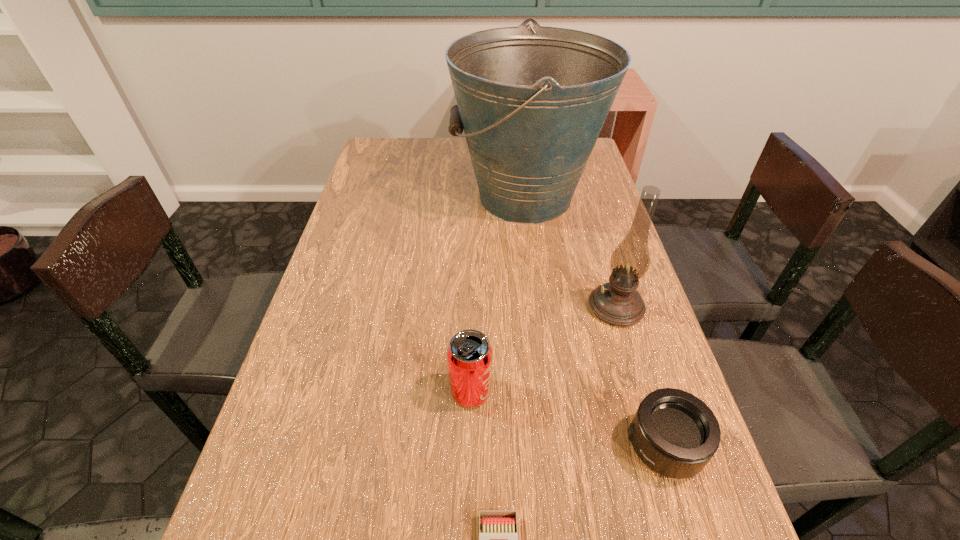
This screenshot has height=540, width=960. In order to click on the tallest object in this screenshot , I will do `click(532, 102)`.

Identify the location of the farthest object. The height and width of the screenshot is (540, 960). (532, 102).

Identify the location of the second tallest object. Image resolution: width=960 pixels, height=540 pixels. (618, 303).

This screenshot has height=540, width=960. Identify the location of the second farthest object. (618, 303).

Locate an element on the screen. This screenshot has width=960, height=540. soda can is located at coordinates (469, 354).

What are the coordinates of `the third shortest object` in the screenshot? It's located at (469, 354).

Find the location of a particular element. This screenshot has height=540, width=960. the second nearest object is located at coordinates (674, 433).

I want to click on telephoto lens, so pyautogui.click(x=674, y=433).

Locate an element on the screen. This screenshot has width=960, height=540. vacant space situated 0.260m with the handle on opposite sides of the tallest object is located at coordinates (367, 197).

Find the location of a particular element. vacant space located 0.160m with the handle on opposite sides of the tallest object is located at coordinates (399, 197).